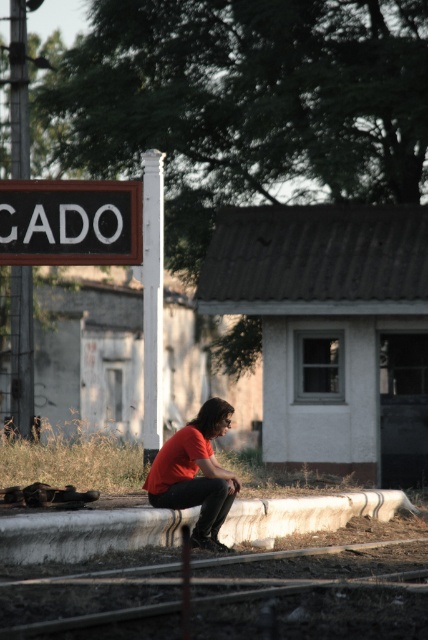
Question: Does smooth concrete train track at lower center have a smaller size compared to matte red shirt at center?

Choices:
 (A) yes
 (B) no

Answer: (B)

Question: Which point appears closest to the camera in this image?

Choices:
 (A) (222, 544)
 (B) (250, 586)

Answer: (B)

Question: Observing the image, what is the correct spatial positioning of smooth concrete train track at lower center in reference to black painted wood sign at upper left?

Choices:
 (A) below
 (B) above

Answer: (A)

Question: Which object is farther from the camera taking this photo?

Choices:
 (A) black painted wood sign at upper left
 (B) matte red shirt at center
 (C) smooth concrete train track at lower center

Answer: (A)

Question: Does black painted wood sign at upper left appear on the left side of matte red shirt at center?

Choices:
 (A) yes
 (B) no

Answer: (A)

Question: Which point is closer to the camera?

Choices:
 (A) (56, 237)
 (B) (196, 470)

Answer: (B)